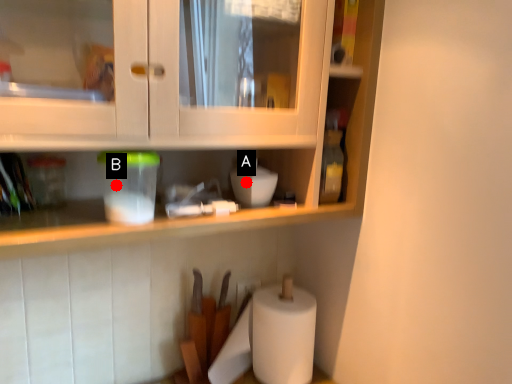
Question: Two points are circled on the image, labeled by A and B beside each circle. Which of the following is the farthest from the observer?

Choices:
 (A) A is further
 (B) B is further

Answer: (A)